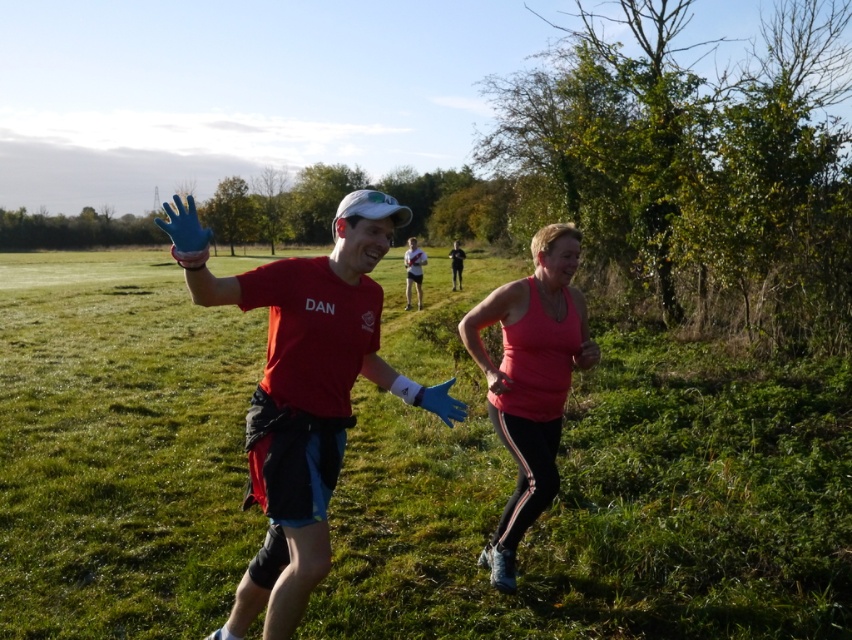
You are a photographer trying to capture a wide shot of the green grassy field at center and the matte blue gloves at center. Which object will occupy more space in your photo?

The green grassy field at center will occupy more space in the photo because its width is larger than that of the matte blue gloves at center.

You are a photographer standing in the middle of the green grassy field at center and the matte blue gloves at center. You want to take a photo of the person on the right. Which direction should you move to get a better shot?

Since the green grassy field at center is to the left of matte blue gloves at center, you should move to the right to position yourself closer to the person on the right.